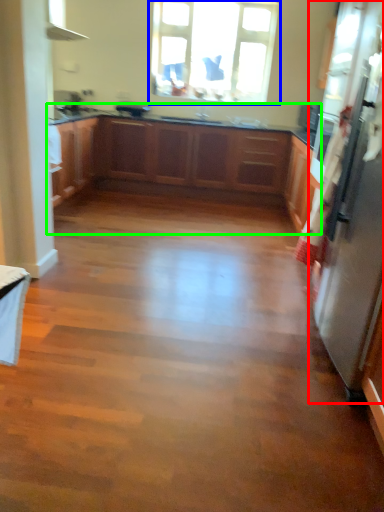
Question: Estimate the real-world distances between objects in this image. Which object is closer to appliance (highlighted by a red box), window (highlighted by a blue box) or cabinetry (highlighted by a green box)?

Choices:
 (A) window
 (B) cabinetry

Answer: (B)